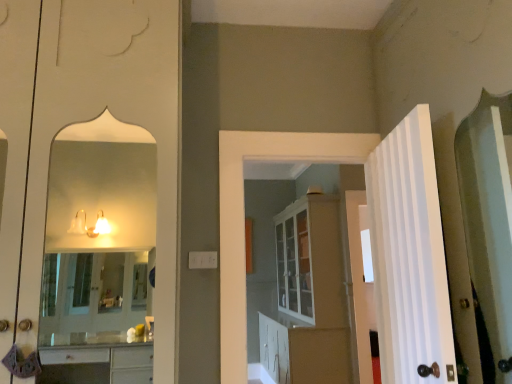
The height and width of the screenshot is (384, 512). Describe the element at coordinates (302, 297) in the screenshot. I see `white glossy cabinet at center` at that location.

This screenshot has width=512, height=384. Describe the element at coordinates (244, 215) in the screenshot. I see `white glossy cabinet at center, the third door positioned from the right` at that location.

The image size is (512, 384). Identify the location of white glossy cabinet at center, positioned as the first door in left-to-right order. (244, 215).

The image size is (512, 384). Identify the location of white glossy door at right, which is the 1th door in back-to-front order. click(358, 288).

The height and width of the screenshot is (384, 512). What do you see at coordinates (358, 288) in the screenshot?
I see `white glossy door at right, which is the 1th door in right-to-left order` at bounding box center [358, 288].

This screenshot has height=384, width=512. Identify the location of white glossy cabinet at center. (302, 297).

From the picture: Which object is thinner, white glossy cabinet at center, which ranks as the second door in front-to-back order, or white striped door at right, which appears as the 2th door when viewed from the right?

With smaller width is white glossy cabinet at center, which ranks as the second door in front-to-back order.

Starting from the white striped door at right, which appears as the first door when viewed from the front, which door is the 1st one behind? Please provide its 2D coordinates.

[(244, 215)]

Can you confirm if white glossy cabinet at center, placed as the second door when sorted from back to front, is taller than white striped door at right, which appears as the first door when viewed from the front?

Correct, white glossy cabinet at center, placed as the second door when sorted from back to front, is much taller as white striped door at right, which appears as the first door when viewed from the front.

From the image's perspective, is white glossy cabinet at center, placed as the second door when sorted from back to front, positioned above or below white striped door at right, which ranks as the third door in back-to-front order?

white glossy cabinet at center, placed as the second door when sorted from back to front, is situated lower than white striped door at right, which ranks as the third door in back-to-front order, in the image.

From the picture: Considering the sizes of objects white striped door at right, which appears as the 2th door when viewed from the right, and white glossy door at right, the third door in the front-to-back sequence, in the image provided, who is wider, white striped door at right, which appears as the 2th door when viewed from the right, or white glossy door at right, the third door in the front-to-back sequence,?

Wider between the two is white striped door at right, which appears as the 2th door when viewed from the right.

Looking at the image, does white striped door at right, which ranks as the third door in back-to-front order, seem bigger or smaller compared to white glossy door at right, which is the 1th door in back-to-front order?

white striped door at right, which ranks as the third door in back-to-front order, is bigger than white glossy door at right, which is the 1th door in back-to-front order.

The width and height of the screenshot is (512, 384). Identify the location of the 2nd door in front of the white glossy door at right, which is the 1th door in right-to-left order. (409, 256).

Can we say white striped door at right, which ranks as the third door in back-to-front order, lies outside white glossy cabinet at center?

white striped door at right, which ranks as the third door in back-to-front order, lies outside white glossy cabinet at center's area.

Would you say white striped door at right, which ranks as the third door in back-to-front order, is to the left or to the right of white glossy cabinet at center in the picture?

Clearly, white striped door at right, which ranks as the third door in back-to-front order, is on the right of white glossy cabinet at center in the image.

Consider the image. Is white striped door at right, which ranks as the third door in back-to-front order, wider than white glossy cabinet at center?

Incorrect, the width of white striped door at right, which ranks as the third door in back-to-front order, does not surpass that of white glossy cabinet at center.

Considering the positions of objects white striped door at right, which ranks as the third door in back-to-front order, and white glossy cabinet at center in the image provided, who is behind, white striped door at right, which ranks as the third door in back-to-front order, or white glossy cabinet at center?

white glossy cabinet at center.

Is white glossy cabinet at center, positioned as the first door in left-to-right order, located within white striped door at right, which ranks as the third door in back-to-front order?

No, white glossy cabinet at center, positioned as the first door in left-to-right order, is located outside of white striped door at right, which ranks as the third door in back-to-front order.

Between white striped door at right, which appears as the 2th door when viewed from the right, and white glossy cabinet at center, positioned as the first door in left-to-right order, which one has smaller size?

white striped door at right, which appears as the 2th door when viewed from the right.

Could you tell me if white striped door at right, which ranks as the third door in back-to-front order, is turned towards white glossy cabinet at center, which ranks as the second door in front-to-back order?

Yes, white striped door at right, which ranks as the third door in back-to-front order, is facing white glossy cabinet at center, which ranks as the second door in front-to-back order.

Does point (389, 135) appear closer or farther from the camera than point (240, 151)?

Point (389, 135).

In the scene shown: Considering the relative sizes of white glossy door at right, which is the 1th door in right-to-left order, and white glossy cabinet at center in the image provided, is white glossy door at right, which is the 1th door in right-to-left order, bigger than white glossy cabinet at center?

Actually, white glossy door at right, which is the 1th door in right-to-left order, might be smaller than white glossy cabinet at center.

Is point (361, 379) farther from camera compared to point (281, 375)?

That is False.

Is white glossy door at right, which is counted as the 3th door, starting from the left, shorter than white glossy cabinet at center?

Yes, white glossy door at right, which is counted as the 3th door, starting from the left, is shorter than white glossy cabinet at center.

From the image's perspective, does white glossy door at right, which is the 1th door in back-to-front order, appear higher than white glossy cabinet at center?

Yes, from the image's perspective, white glossy door at right, which is the 1th door in back-to-front order, is on top of white glossy cabinet at center.

From a real-world perspective, is white glossy cabinet at center, placed as the second door when sorted from back to front, under white glossy cabinet at center?

Actually, white glossy cabinet at center, placed as the second door when sorted from back to front, is physically above white glossy cabinet at center in the real world.

From the image's perspective, between white glossy cabinet at center, the third door positioned from the right, and white glossy cabinet at center, which one is located above?

white glossy cabinet at center, the third door positioned from the right, appears higher in the image.

From the picture: Which is behind, white glossy cabinet at center, which ranks as the second door in front-to-back order, or white glossy cabinet at center?

white glossy cabinet at center is further away from the camera.

Is white glossy cabinet at center positioned far away from white glossy door at right, which is counted as the 3th door, starting from the left?

They are positioned close to each other.

From a real-world perspective, which object stands above the other?

white glossy door at right, which is the 1th door in back-to-front order.

Is white glossy cabinet at center bigger than white glossy door at right, the third door in the front-to-back sequence?

Correct, white glossy cabinet at center is larger in size than white glossy door at right, the third door in the front-to-back sequence.

Locate an element on the screen. The height and width of the screenshot is (384, 512). door that is the 1st object located above the white glossy cabinet at center (from the image's perspective) is located at coordinates (358, 288).

Find the location of a particular element. This screenshot has height=384, width=512. door located in front of the white glossy cabinet at center, positioned as the first door in left-to-right order is located at coordinates (409, 256).

This screenshot has width=512, height=384. Find the location of `the 1st door to the left of the white glossy door at right, which is the 1th door in right-to-left order, starting your count from the anchor`. the 1st door to the left of the white glossy door at right, which is the 1th door in right-to-left order, starting your count from the anchor is located at coordinates point(409,256).

From the image, which object appears to be nearer to white glossy cabinet at center, white glossy cabinet at center, the third door positioned from the right, or white glossy door at right, which is the 1th door in right-to-left order?

white glossy door at right, which is the 1th door in right-to-left order, is positioned closer to the anchor white glossy cabinet at center.

From the image, which object appears to be nearer to white striped door at right, placed as the second door when sorted from left to right, white glossy door at right, which is the 1th door in right-to-left order, or white glossy cabinet at center?

white glossy door at right, which is the 1th door in right-to-left order, lies closer to white striped door at right, placed as the second door when sorted from left to right, than the other object.

From the image, which object appears to be nearer to white glossy cabinet at center, white glossy cabinet at center, the third door positioned from the right, or white striped door at right, which appears as the first door when viewed from the front?

white glossy cabinet at center, the third door positioned from the right, lies closer to white glossy cabinet at center than the other object.

From the image, which object appears to be nearer to white glossy cabinet at center, white striped door at right, which appears as the first door when viewed from the front, or white glossy cabinet at center, which ranks as the second door in front-to-back order?

The object closer to white glossy cabinet at center is white glossy cabinet at center, which ranks as the second door in front-to-back order.

Considering their positions, is white striped door at right, which appears as the first door when viewed from the front, positioned closer to white glossy cabinet at center, placed as the second door when sorted from back to front, than white glossy door at right, which is the 1th door in right-to-left order?

white striped door at right, which appears as the first door when viewed from the front, is closer to white glossy cabinet at center, placed as the second door when sorted from back to front.

From the image, which object appears to be farther from white glossy door at right, the third door in the front-to-back sequence, white glossy cabinet at center, positioned as the first door in left-to-right order, or white striped door at right, which appears as the 2th door when viewed from the right?

The object further to white glossy door at right, the third door in the front-to-back sequence, is white striped door at right, which appears as the 2th door when viewed from the right.

When comparing their distances from white striped door at right, placed as the second door when sorted from left to right, does white glossy cabinet at center, placed as the second door when sorted from back to front, or white glossy door at right, which is the 1th door in back-to-front order, seem further?

Based on the image, white glossy door at right, which is the 1th door in back-to-front order, appears to be further to white striped door at right, placed as the second door when sorted from left to right.

Based on their spatial positions, is white glossy door at right, which is counted as the 3th door, starting from the left, or white glossy cabinet at center, which ranks as the second door in front-to-back order, closer to white glossy cabinet at center?

The object closer to white glossy cabinet at center is white glossy door at right, which is counted as the 3th door, starting from the left.

This screenshot has width=512, height=384. Find the location of `door between white striped door at right, which appears as the first door when viewed from the front, and white glossy cabinet at center in the front-back direction`. door between white striped door at right, which appears as the first door when viewed from the front, and white glossy cabinet at center in the front-back direction is located at coordinates (244, 215).

Find the location of a particular element. The height and width of the screenshot is (384, 512). dresser positioned between white striped door at right, which appears as the first door when viewed from the front, and white glossy door at right, which is the 1th door in back-to-front order, from near to far is located at coordinates (302, 297).

Locate an element on the screen. This screenshot has height=384, width=512. dresser between white glossy cabinet at center, placed as the second door when sorted from back to front, and white glossy door at right, which is counted as the 3th door, starting from the left, from front to back is located at coordinates (302, 297).

Locate an element on the screen. door located between white striped door at right, which appears as the 2th door when viewed from the right, and white glossy door at right, which is the 1th door in back-to-front order, in the depth direction is located at coordinates (244, 215).